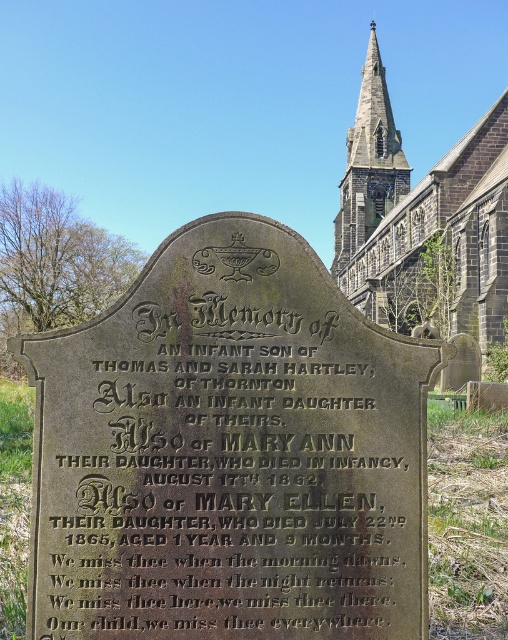
Is the position of dark gray stone inscription at center less distant than that of dark gray stone church steeple at upper center?

Yes, it is in front of dark gray stone church steeple at upper center.

Is point (56, 636) closer to viewer compared to point (392, 216)?

Yes, point (56, 636) is closer to viewer.

This screenshot has height=640, width=508. Describe the element at coordinates (229, 472) in the screenshot. I see `dark gray stone inscription at center` at that location.

Locate an element on the screen. The image size is (508, 640). dark gray stone inscription at center is located at coordinates (229, 472).

Looking at this image, who is taller, dark gray stone inscription at center or dark gray stone spire at upper center?

Standing taller between the two is dark gray stone spire at upper center.

Is dark gray stone inscription at center smaller than dark gray stone spire at upper center?

Indeed, dark gray stone inscription at center has a smaller size compared to dark gray stone spire at upper center.

Which is in front, point (341, 513) or point (353, 150)?

Positioned in front is point (341, 513).

Where is `dark gray stone inscription at center`? dark gray stone inscription at center is located at coordinates (229, 472).

Is the position of dark gray stone church steeple at upper center less distant than that of dark gray stone spire at upper center?

Yes, it is in front of dark gray stone spire at upper center.

Does dark gray stone church steeple at upper center appear on the right side of dark gray stone spire at upper center?

Correct, you'll find dark gray stone church steeple at upper center to the right of dark gray stone spire at upper center.

The width and height of the screenshot is (508, 640). Describe the element at coordinates (422, 216) in the screenshot. I see `dark gray stone church steeple at upper center` at that location.

In order to click on dark gray stone church steeple at upper center in this screenshot , I will do `click(422, 216)`.